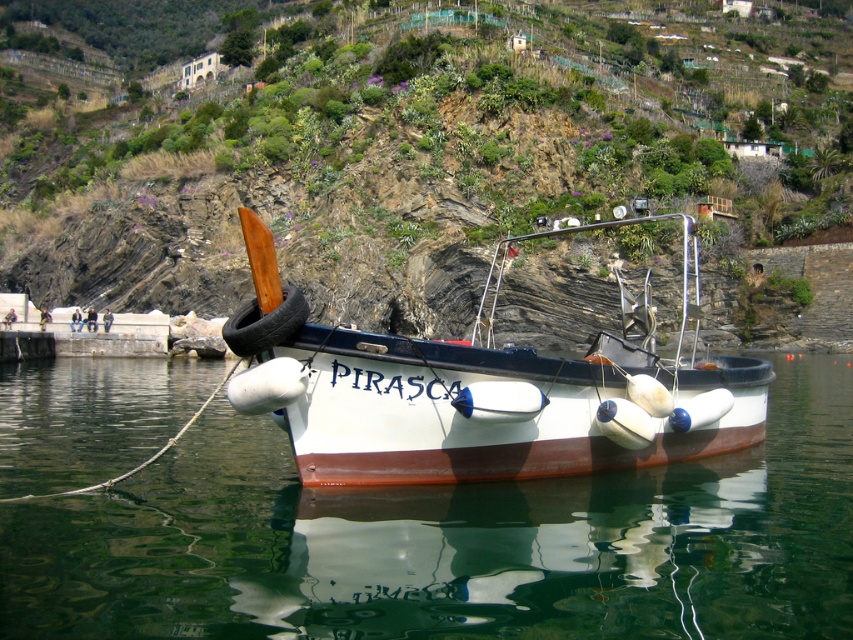
Question: Does green grassy hillside at upper center appear on the left side of white matte fishing boat at center?

Choices:
 (A) yes
 (B) no

Answer: (B)

Question: Is green grassy hillside at upper center positioned in front of white matte fishing boat at center?

Choices:
 (A) yes
 (B) no

Answer: (B)

Question: Which point is closer to the camera?

Choices:
 (A) (56, 360)
 (B) (96, 161)
 (C) (753, 380)

Answer: (C)

Question: Which object appears closest to the camera in this image?

Choices:
 (A) white matte fishing boat at center
 (B) transparent water at center
 (C) green grassy hillside at upper center

Answer: (B)

Question: From the image, what is the correct spatial relationship of transparent water at center in relation to white matte fishing boat at center?

Choices:
 (A) left
 (B) right

Answer: (A)

Question: Among these objects, which one is nearest to the camera?

Choices:
 (A) green grassy hillside at upper center
 (B) transparent water at center

Answer: (B)